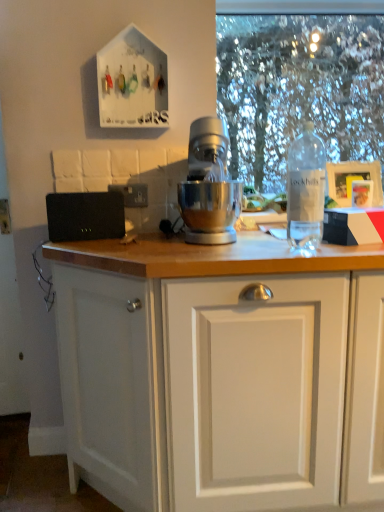
Question: Should I look upward or downward to see clear plastic bottle at right?

Choices:
 (A) down
 (B) up

Answer: (B)

Question: Considering the relative sizes of clear plastic bottle at right and black plastic electric outlet at upper left in the image provided, is clear plastic bottle at right smaller than black plastic electric outlet at upper left?

Choices:
 (A) yes
 (B) no

Answer: (B)

Question: From the image's perspective, does clear plastic bottle at right appear higher than black plastic electric outlet at upper left?

Choices:
 (A) no
 (B) yes

Answer: (B)

Question: Considering the relative positions of clear plastic bottle at right and black plastic electric outlet at upper left in the image provided, is clear plastic bottle at right behind black plastic electric outlet at upper left?

Choices:
 (A) no
 (B) yes

Answer: (B)

Question: Is clear plastic bottle at right facing towards black plastic electric outlet at upper left?

Choices:
 (A) no
 (B) yes

Answer: (A)

Question: Can you confirm if clear plastic bottle at right is thinner than black plastic electric outlet at upper left?

Choices:
 (A) yes
 (B) no

Answer: (B)

Question: Considering the relative sizes of clear plastic bottle at right and black plastic electric outlet at upper left in the image provided, is clear plastic bottle at right shorter than black plastic electric outlet at upper left?

Choices:
 (A) no
 (B) yes

Answer: (A)

Question: From the image's perspective, is clear plastic bottle at right on silver metallic mixer at center?

Choices:
 (A) yes
 (B) no

Answer: (B)

Question: Is silver metallic mixer at center a part of clear plastic bottle at right?

Choices:
 (A) no
 (B) yes

Answer: (A)

Question: Could you tell me if clear plastic bottle at right is facing silver metallic mixer at center?

Choices:
 (A) yes
 (B) no

Answer: (B)

Question: From the image's perspective, is clear plastic bottle at right below silver metallic mixer at center?

Choices:
 (A) no
 (B) yes

Answer: (B)

Question: Is the depth of clear plastic bottle at right greater than that of silver metallic mixer at center?

Choices:
 (A) no
 (B) yes

Answer: (A)

Question: Is clear plastic bottle at right oriented away from silver metallic mixer at center?

Choices:
 (A) yes
 (B) no

Answer: (B)

Question: Does clear plastic bottle at right appear on the right side of black plastic electric outlet at upper left?

Choices:
 (A) yes
 (B) no

Answer: (A)